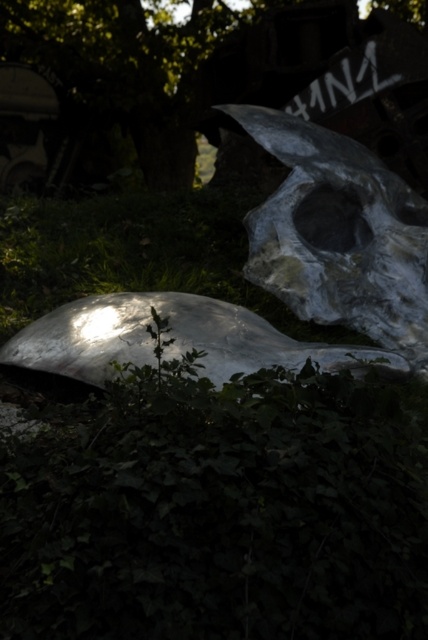
Question: Which object appears closest to the camera in this image?

Choices:
 (A) metallic gray skull at upper right
 (B) green leafy tree at center

Answer: (A)

Question: Is green leafy tree at center to the left of metallic gray skull at upper right from the viewer's perspective?

Choices:
 (A) no
 (B) yes

Answer: (B)

Question: Which point appears closest to the camera in this image?

Choices:
 (A) [424, 224]
 (B) [350, 4]

Answer: (A)

Question: Where is green leafy tree at center located in relation to metallic gray skull at upper right in the image?

Choices:
 (A) above
 (B) below

Answer: (A)

Question: Which point is closer to the camera taking this photo?

Choices:
 (A) (261, 276)
 (B) (249, 12)

Answer: (A)

Question: Can you confirm if green leafy tree at center is positioned to the right of metallic gray skull at upper right?

Choices:
 (A) no
 (B) yes

Answer: (A)